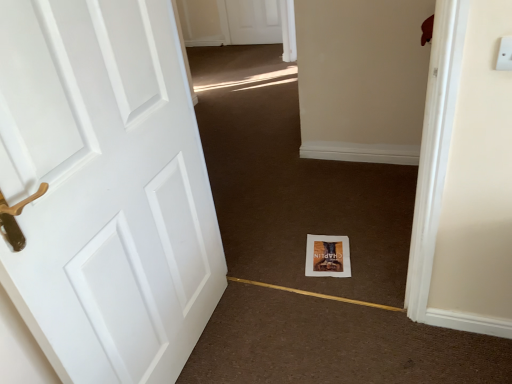
Where is `vacant space situated above matte paper book at center (from a real-world perspective)`? This screenshot has height=384, width=512. vacant space situated above matte paper book at center (from a real-world perspective) is located at coordinates (331, 254).